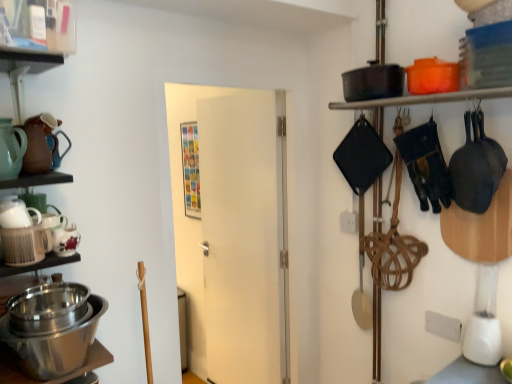
In order to click on free point above stainless steel bowls at lower left (from a real-world perspective) in this screenshot , I will do `click(58, 303)`.